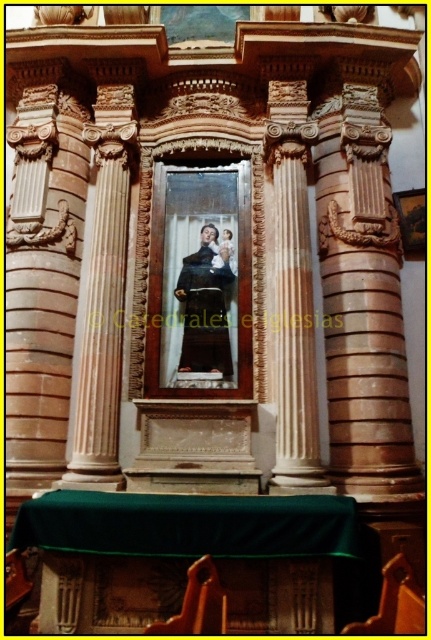
Question: Does brown polished stone column at right appear on the right side of matte black robe at center?

Choices:
 (A) no
 (B) yes

Answer: (B)

Question: Which object is closer to the camera taking this photo?

Choices:
 (A) matte black robe at center
 (B) brown polished stone column at right

Answer: (B)

Question: Does brown polished stone column at right have a lesser width compared to matte black robe at center?

Choices:
 (A) no
 (B) yes

Answer: (A)

Question: Which point appears closest to the camera in this image?

Choices:
 (A) (405, 477)
 (B) (180, 273)

Answer: (A)

Question: Does brown polished stone column at right have a larger size compared to matte black robe at center?

Choices:
 (A) no
 (B) yes

Answer: (B)